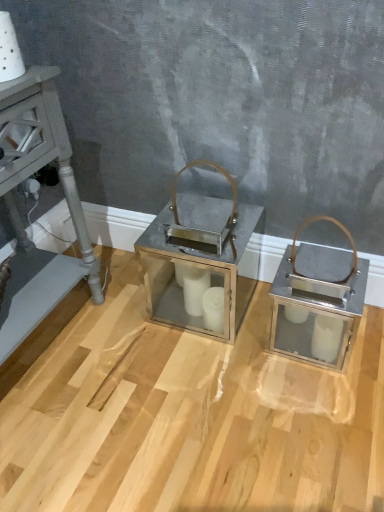
Identify the location of vacant area that lies between metallic silver lantern at center and metallic gray side table at left. This screenshot has height=512, width=384. (119, 345).